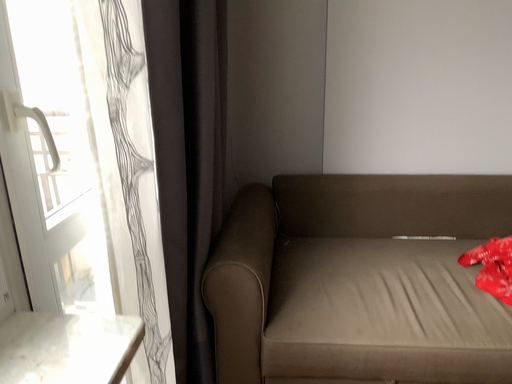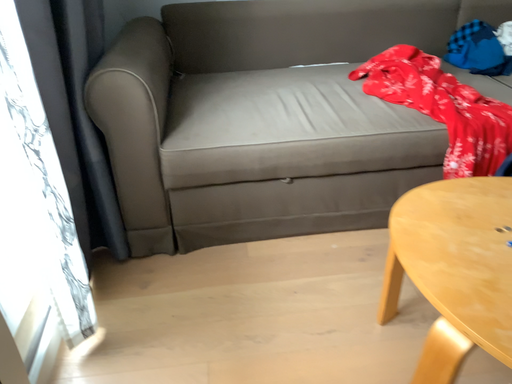
Question: How did the camera likely rotate when shooting the video?

Choices:
 (A) rotated upward
 (B) rotated downward

Answer: (B)